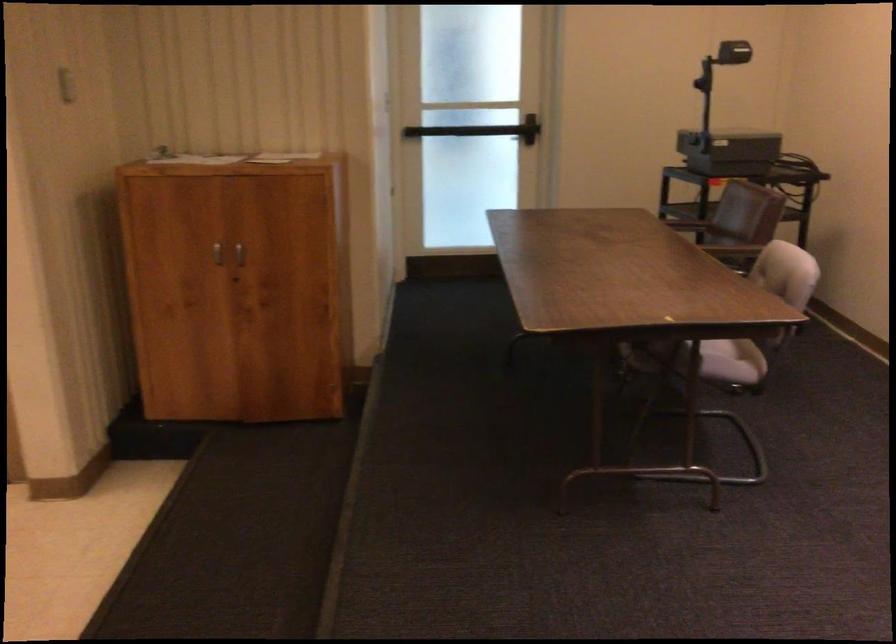
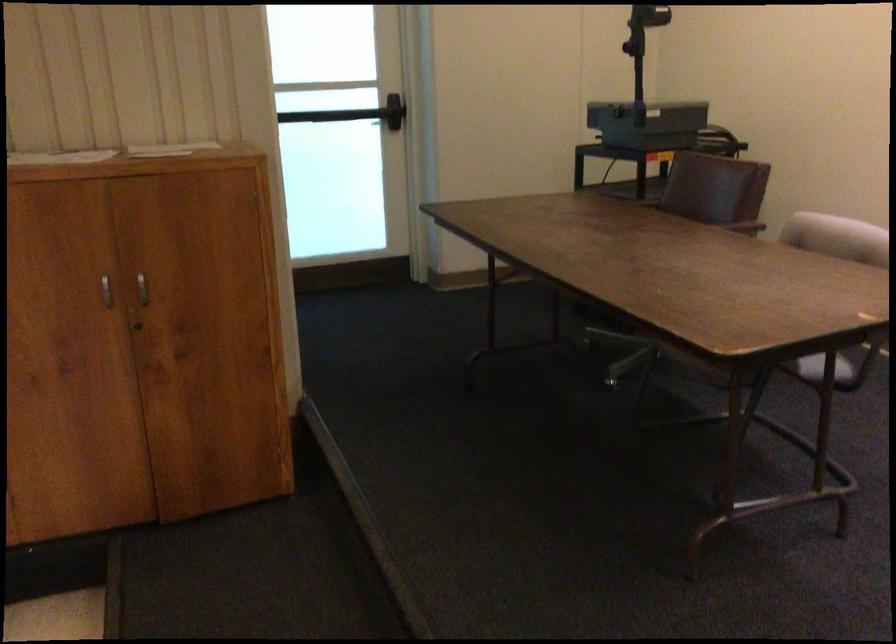
The images are taken continuously from a first-person perspective. In which direction are you moving?

The movement direction of the cameraman is left, forward.